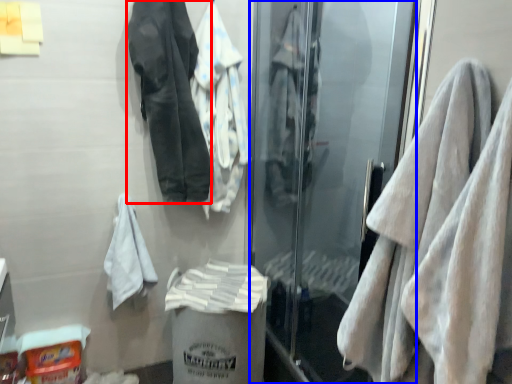
Question: Which point is closer to the camera, jacket (highlighted by a red box) or screen door (highlighted by a blue box)?

Choices:
 (A) jacket
 (B) screen door

Answer: (B)